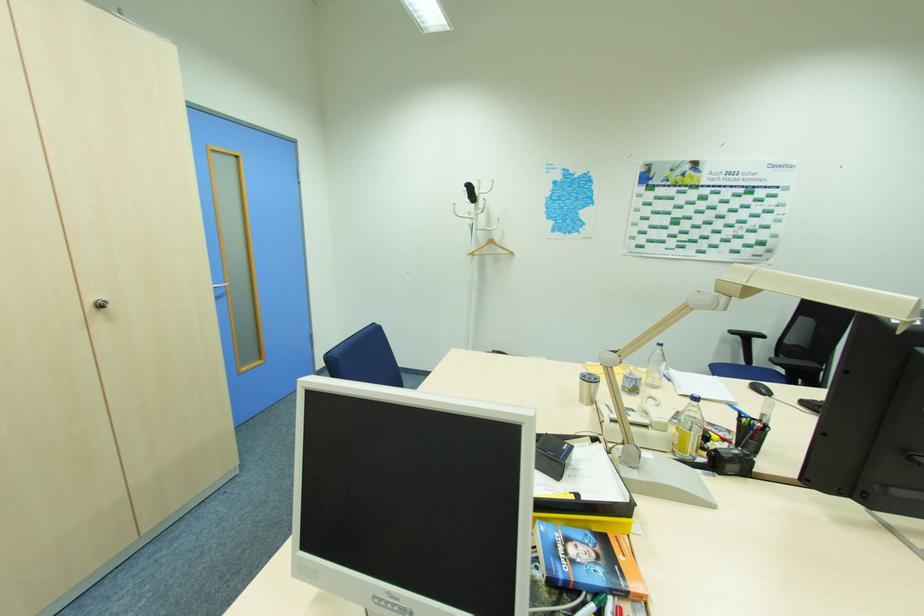
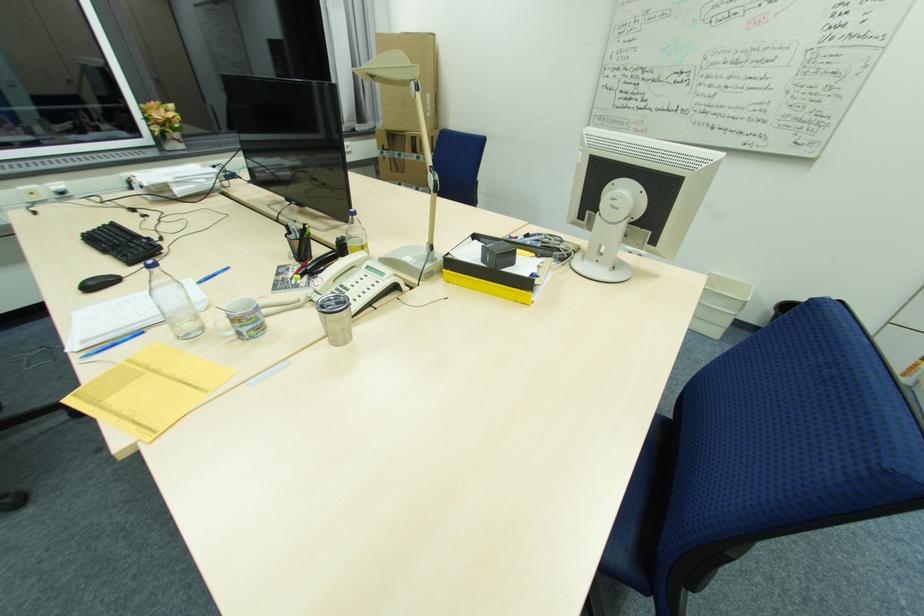
Locate, in the second image, the point that corresponds to the point at 663,347 in the first image.

(157, 270)